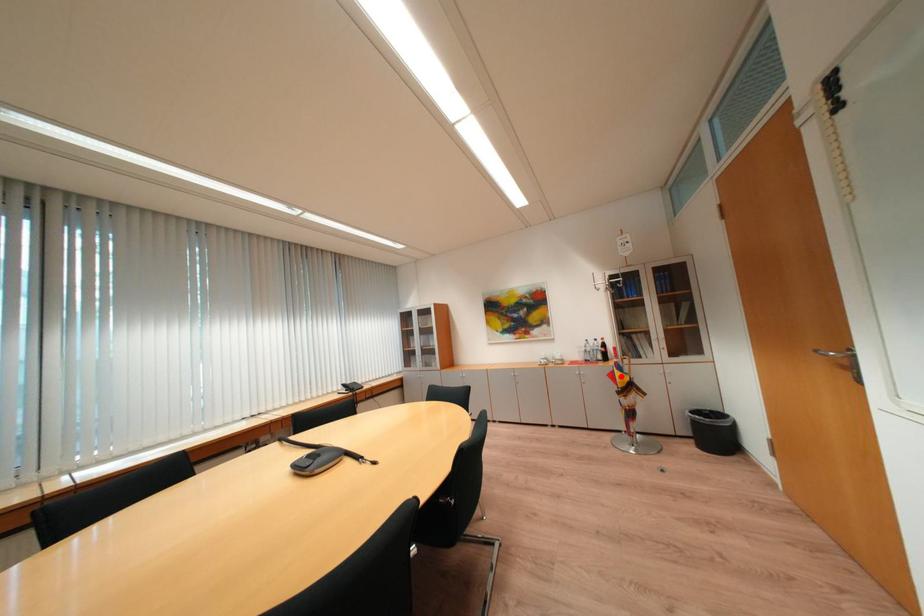
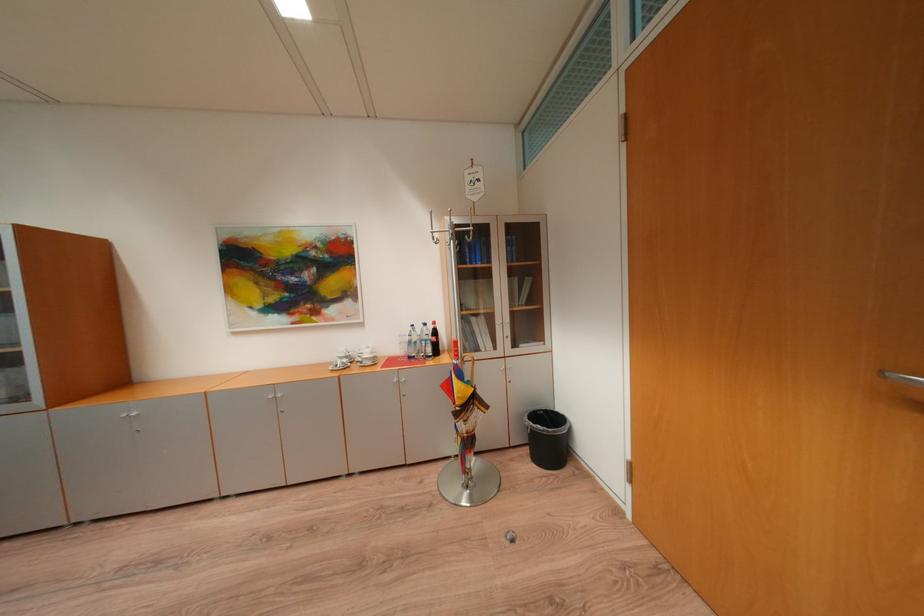
Locate, in the second image, the point that corresponds to the highlighted location in the first image.

(456, 387)